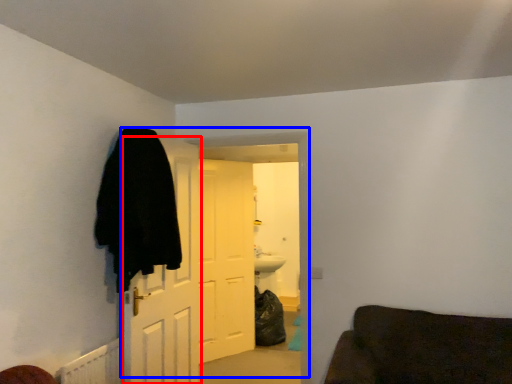
Question: Which point is closer to the camera, door (highlighted by a red box) or door (highlighted by a blue box)?

Choices:
 (A) door
 (B) door

Answer: (A)